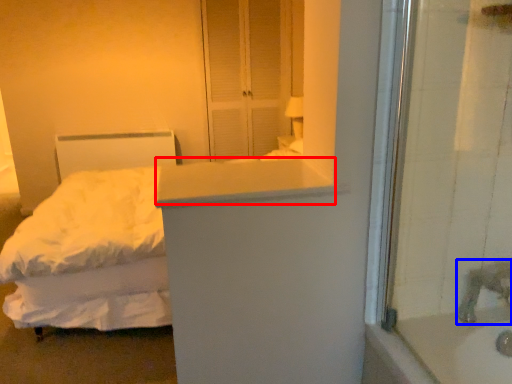
Question: Which object is further to the camera taking this photo, counter top (highlighted by a red box) or faucet (highlighted by a blue box)?

Choices:
 (A) counter top
 (B) faucet

Answer: (B)